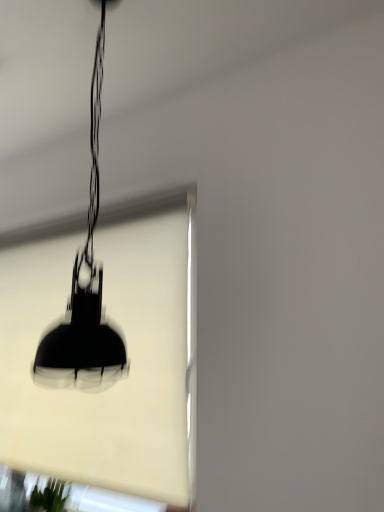
Question: Considering the positions of black matte lampshade at center and black matte lamp at center in the image, is black matte lampshade at center taller or shorter than black matte lamp at center?

Choices:
 (A) tall
 (B) short

Answer: (A)

Question: Is black matte lampshade at center inside the boundaries of black matte lamp at center, or outside?

Choices:
 (A) outside
 (B) inside

Answer: (A)

Question: Is point (69, 490) positioned closer to the camera than point (89, 345)?

Choices:
 (A) closer
 (B) farther

Answer: (B)

Question: From a real-world perspective, relative to black matte lampshade at center, is black matte lamp at center vertically above or below?

Choices:
 (A) below
 (B) above

Answer: (B)

Question: Considering the positions of point (87, 309) and point (167, 371), is point (87, 309) closer or farther from the camera than point (167, 371)?

Choices:
 (A) closer
 (B) farther

Answer: (A)

Question: In the image, is black matte lamp at center positioned in front of or behind black matte lampshade at center?

Choices:
 (A) front
 (B) behind

Answer: (A)

Question: Considering the positions of black matte lamp at center and black matte lampshade at center in the image, is black matte lamp at center wider or thinner than black matte lampshade at center?

Choices:
 (A) thin
 (B) wide

Answer: (B)